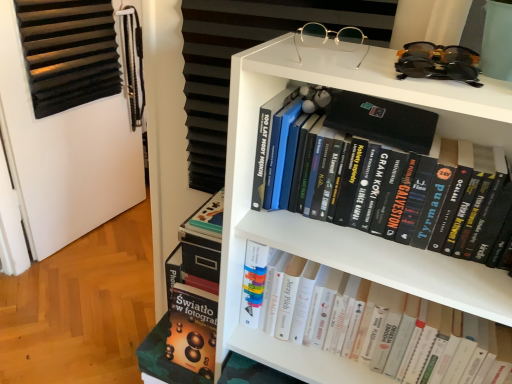
Question: Can you confirm if black plastic sunglasses at upper right, marked as the 1th glasses in a right-to-left arrangement, is positioned to the left of gold metallic glasses at upper center, marked as the 1th glasses in a left-to-right arrangement?

Choices:
 (A) yes
 (B) no

Answer: (B)

Question: Can you confirm if black plastic sunglasses at upper right, marked as the 1th glasses in a right-to-left arrangement, is thinner than gold metallic glasses at upper center, the 2th glasses viewed from the right?

Choices:
 (A) no
 (B) yes

Answer: (A)

Question: Is black plastic sunglasses at upper right, marked as the 1th glasses in a right-to-left arrangement, oriented away from gold metallic glasses at upper center, marked as the 1th glasses in a left-to-right arrangement?

Choices:
 (A) no
 (B) yes

Answer: (A)

Question: From a real-world perspective, is black plastic sunglasses at upper right, marked as the 1th glasses in a right-to-left arrangement, located higher than gold metallic glasses at upper center, the 2th glasses viewed from the right?

Choices:
 (A) yes
 (B) no

Answer: (A)

Question: From a real-world perspective, is black plastic sunglasses at upper right, the 2th glasses when ordered from left to right, located beneath gold metallic glasses at upper center, the 2th glasses viewed from the right?

Choices:
 (A) yes
 (B) no

Answer: (B)

Question: Would you say white matte bookcase at upper center is to the left or to the right of gold metallic glasses at upper center, marked as the 1th glasses in a left-to-right arrangement, in the picture?

Choices:
 (A) right
 (B) left

Answer: (B)

Question: From the image's perspective, relative to gold metallic glasses at upper center, marked as the 1th glasses in a left-to-right arrangement, is white matte bookcase at upper center above or below?

Choices:
 (A) below
 (B) above

Answer: (A)

Question: From a real-world perspective, relative to gold metallic glasses at upper center, the 2th glasses viewed from the right, is white matte bookcase at upper center vertically above or below?

Choices:
 (A) below
 (B) above

Answer: (A)

Question: Based on their sizes in the image, would you say white matte bookcase at upper center is bigger or smaller than gold metallic glasses at upper center, marked as the 1th glasses in a left-to-right arrangement?

Choices:
 (A) big
 (B) small

Answer: (A)

Question: Considering the relative positions of hardcover books at center, which is the 2th book from top to bottom, and black matte book at upper center, the first book positioned from the top, in the image provided, is hardcover books at center, which is the 2th book from top to bottom, to the left or to the right of black matte book at upper center, the first book positioned from the top,?

Choices:
 (A) left
 (B) right

Answer: (B)

Question: Is hardcover books at center, which is the first book from bottom to top, wider or thinner than black matte book at upper center, the first book positioned from the top?

Choices:
 (A) thin
 (B) wide

Answer: (B)

Question: In the image, is hardcover books at center, which is the 2th book from top to bottom, positioned in front of or behind black matte book at upper center, the 2th book from the bottom?

Choices:
 (A) behind
 (B) front

Answer: (A)

Question: From a real-world perspective, relative to black matte book at upper center, the first book positioned from the top, is hardcover books at center, which is the 2th book from top to bottom, vertically above or below?

Choices:
 (A) below
 (B) above

Answer: (A)

Question: From a real-world perspective, relative to black plastic sunglasses at upper right, marked as the 1th glasses in a right-to-left arrangement, is black matte book at upper center, the 2th book from the bottom, vertically above or below?

Choices:
 (A) below
 (B) above

Answer: (A)

Question: In the image, is black matte book at upper center, the first book positioned from the top, positioned in front of or behind black plastic sunglasses at upper right, the 2th glasses when ordered from left to right?

Choices:
 (A) front
 (B) behind

Answer: (B)